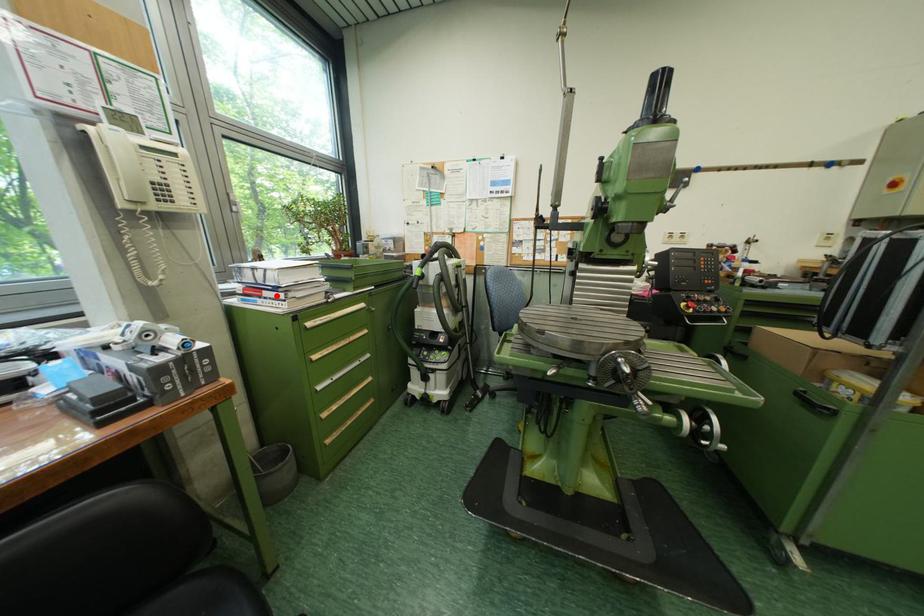
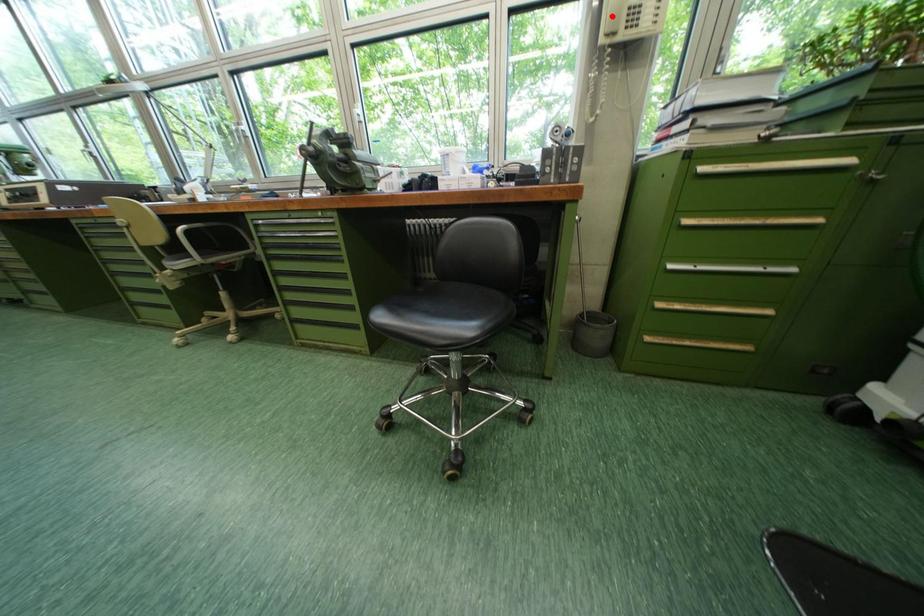
I am providing you with two images of the same scene from different viewpoints. A red point is marked on the first image and another point is marked on the second image. Are the points marked in image1 and image2 representing the same 3D position?

No